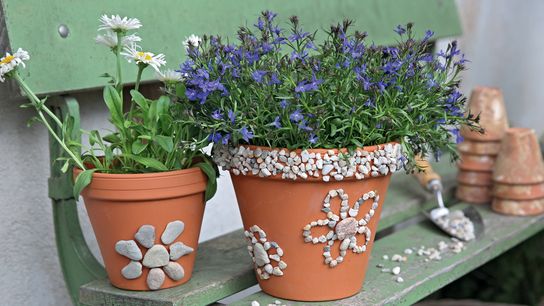
This screenshot has width=544, height=306. Find the location of `stacked upside down flower pots`. stacked upside down flower pots is located at coordinates (512, 207), (520, 192), (518, 165), (490, 112), (486, 145), (483, 163), (469, 180), (474, 194).